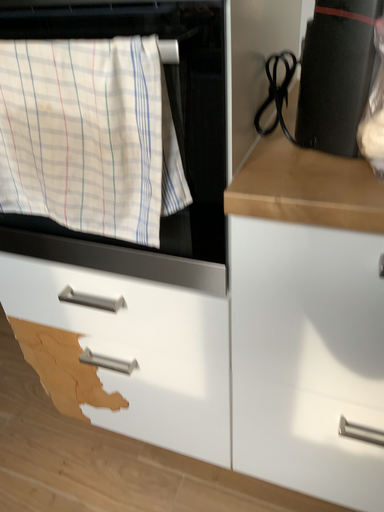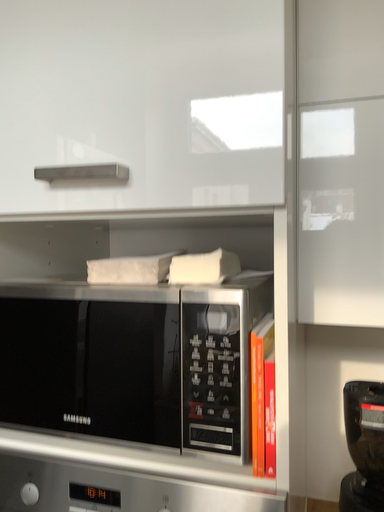
Question: How did the camera likely rotate when shooting the video?

Choices:
 (A) rotated downward
 (B) rotated upward

Answer: (B)